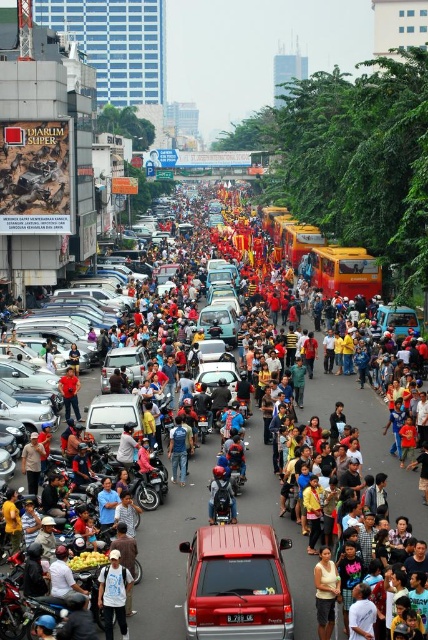
You are a delivery person who needs to navigate through the crowded street. You have a package that needs to be placed on top of the silver metallic van at center. Can you determine if the shiny black motorcycle at center will block the access to the top of the van?

The silver metallic van at center is taller than the shiny black motorcycle at center, so the motorcycle will not block access to the top of the van.

You are a photographer standing at the edge of the crowd capturing the scene. Your camera has a maximum focus range of 100 feet. Can you clearly capture the yellow fabric shirt at center in your photo?

The yellow fabric shirt at center is 103.96 feet away from the camera. Since your camera can only focus up to 100 feet, you cannot clearly capture the yellow fabric shirt at center.